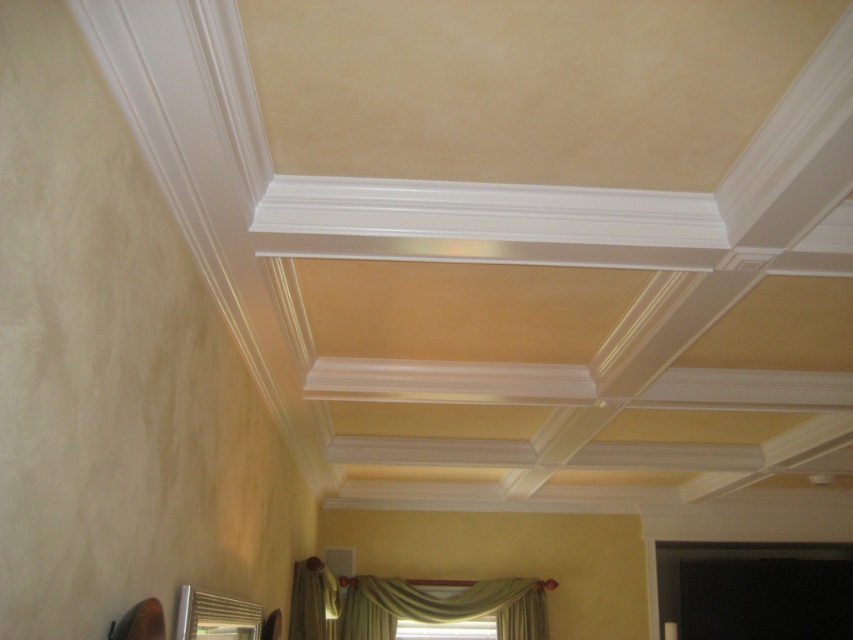
Question: Is green fabric curtain at lower center wider than green velvet curtain at lower center?

Choices:
 (A) no
 (B) yes

Answer: (B)

Question: Which of the following is the farthest from the observer?

Choices:
 (A) green fabric curtain at lower center
 (B) green velvet curtain at lower center

Answer: (A)

Question: Can you confirm if green fabric curtain at lower center is bigger than green velvet curtain at lower center?

Choices:
 (A) yes
 (B) no

Answer: (B)

Question: Does green fabric curtain at lower center appear over green velvet curtain at lower center?

Choices:
 (A) no
 (B) yes

Answer: (A)